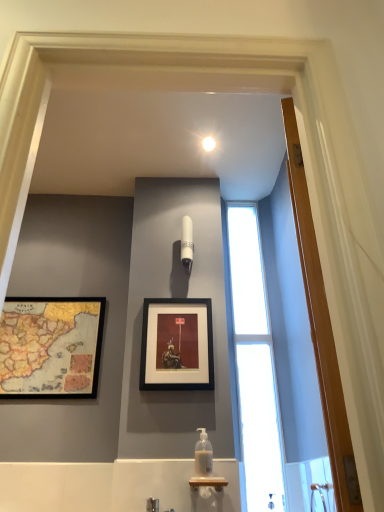
Identify the location of unoccupied area behind white glossy light fixture at upper center. Image resolution: width=384 pixels, height=512 pixels. (218, 160).